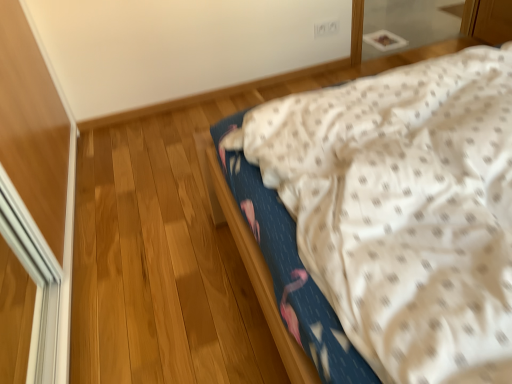
I want to click on white dotted fabric at center, so click(401, 209).

In order to face white dotted fabric at center, should I rotate leftwards or rightwards?

Turn right approximately 30.629 degrees to face it.

Describe the element at coordinates (401, 209) in the screenshot. I see `white dotted fabric at center` at that location.

Find the location of `white dotted fabric at center`. white dotted fabric at center is located at coordinates (401, 209).